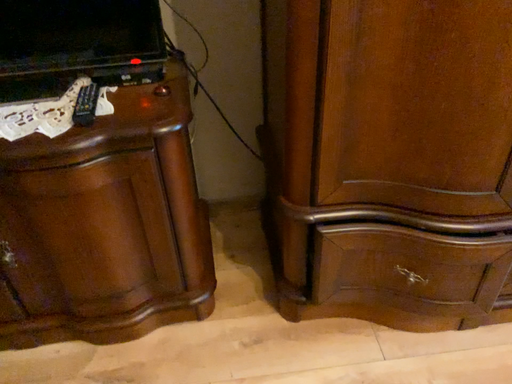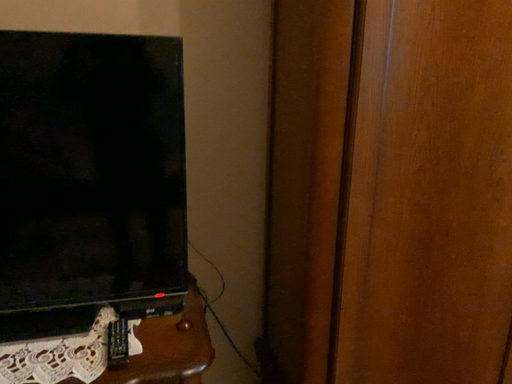
Question: Which way did the camera rotate in the video?

Choices:
 (A) rotated upward
 (B) rotated downward

Answer: (A)